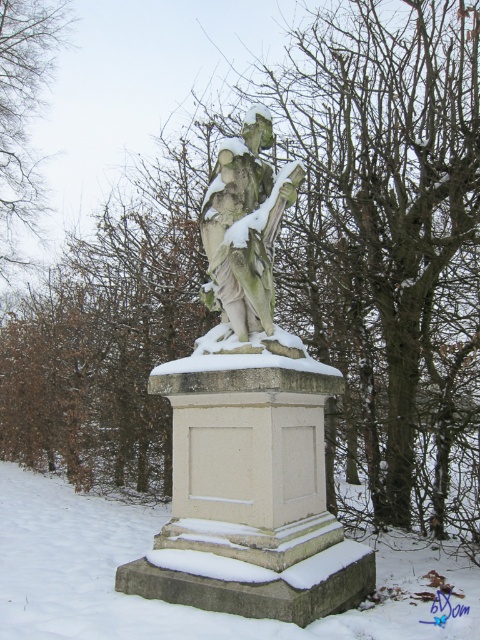
Question: Can you confirm if stone statue at center is positioned below brown leafless tree at upper left?

Choices:
 (A) yes
 (B) no

Answer: (A)

Question: Is white frosty snow at base wider than brown leafless tree at upper left?

Choices:
 (A) no
 (B) yes

Answer: (A)

Question: Which point is farther to the camera?

Choices:
 (A) (222, 227)
 (B) (32, 12)

Answer: (B)

Question: Which object is positioned closest to the stone statue at center?

Choices:
 (A) white frosty snow at base
 (B) brown leafless tree at upper left

Answer: (A)

Question: In this image, where is white frosty snow at base located relative to stone statue at center?

Choices:
 (A) right
 (B) left

Answer: (B)

Question: Estimate the real-world distances between objects in this image. Which object is farther from the white frosty snow at base?

Choices:
 (A) stone statue at center
 (B) brown leafless tree at upper left

Answer: (B)